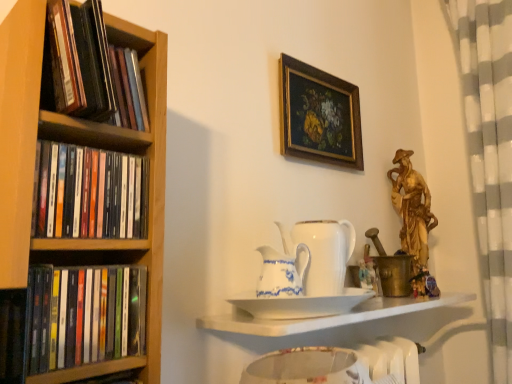
Question: Are black matte bookshelf at left, the 3th book when ordered from bottom to top, and black matte book at left, arranged as the 3th book when viewed from the top, far apart?

Choices:
 (A) yes
 (B) no

Answer: (B)

Question: Is black matte bookshelf at left, the 3th book when ordered from bottom to top, not inside black matte book at left, arranged as the 3th book when viewed from the top?

Choices:
 (A) no
 (B) yes

Answer: (B)

Question: Does black matte bookshelf at left, the 3th book when ordered from bottom to top, have a larger size compared to black matte book at left, arranged as the 3th book when viewed from the top?

Choices:
 (A) no
 (B) yes

Answer: (B)

Question: Is the position of black matte bookshelf at left, the 1th book viewed from the top, less distant than that of black matte book at left, which ranks as the 1th book in bottom-to-top order?

Choices:
 (A) yes
 (B) no

Answer: (B)

Question: From the image's perspective, does black matte bookshelf at left, the 3th book when ordered from bottom to top, appear higher than black matte book at left, which ranks as the 1th book in bottom-to-top order?

Choices:
 (A) no
 (B) yes

Answer: (B)

Question: Is gold-framed painting at upper center in front of or behind black matte bookshelf at left, the 1th book viewed from the top, in the image?

Choices:
 (A) front
 (B) behind

Answer: (B)

Question: From a real-world perspective, relative to black matte bookshelf at left, the 3th book when ordered from bottom to top, is gold-framed painting at upper center vertically above or below?

Choices:
 (A) below
 (B) above

Answer: (B)

Question: Based on their positions, is gold-framed painting at upper center located to the left or right of black matte bookshelf at left, the 1th book viewed from the top?

Choices:
 (A) right
 (B) left

Answer: (A)

Question: Is point (290, 64) closer or farther from the camera than point (79, 38)?

Choices:
 (A) closer
 (B) farther

Answer: (B)

Question: From the image's perspective, is white porcelain tea pot at center, which is the first tea pot in front-to-back order, above or below black matte bookshelf at left, the 1th book viewed from the top?

Choices:
 (A) above
 (B) below

Answer: (B)

Question: Is white porcelain tea pot at center, the 2th tea pot in the back-to-front sequence, in front of or behind black matte bookshelf at left, the 3th book when ordered from bottom to top, in the image?

Choices:
 (A) front
 (B) behind

Answer: (B)

Question: Considering the positions of white porcelain tea pot at center, which is the first tea pot in front-to-back order, and black matte bookshelf at left, the 1th book viewed from the top, in the image, is white porcelain tea pot at center, which is the first tea pot in front-to-back order, wider or thinner than black matte bookshelf at left, the 1th book viewed from the top,?

Choices:
 (A) thin
 (B) wide

Answer: (A)

Question: From a real-world perspective, is white porcelain tea pot at center, the 2th tea pot in the back-to-front sequence, positioned above or below black matte bookshelf at left, the 3th book when ordered from bottom to top?

Choices:
 (A) below
 (B) above

Answer: (A)

Question: From a real-world perspective, is brass/metallic candle holder at right positioned above or below white porcelain teapot at center, which appears as the 2th tea pot when viewed from the front?

Choices:
 (A) above
 (B) below

Answer: (B)

Question: Looking at the image, does brass/metallic candle holder at right seem bigger or smaller compared to white porcelain teapot at center, the 1th tea pot in the back-to-front sequence?

Choices:
 (A) small
 (B) big

Answer: (B)